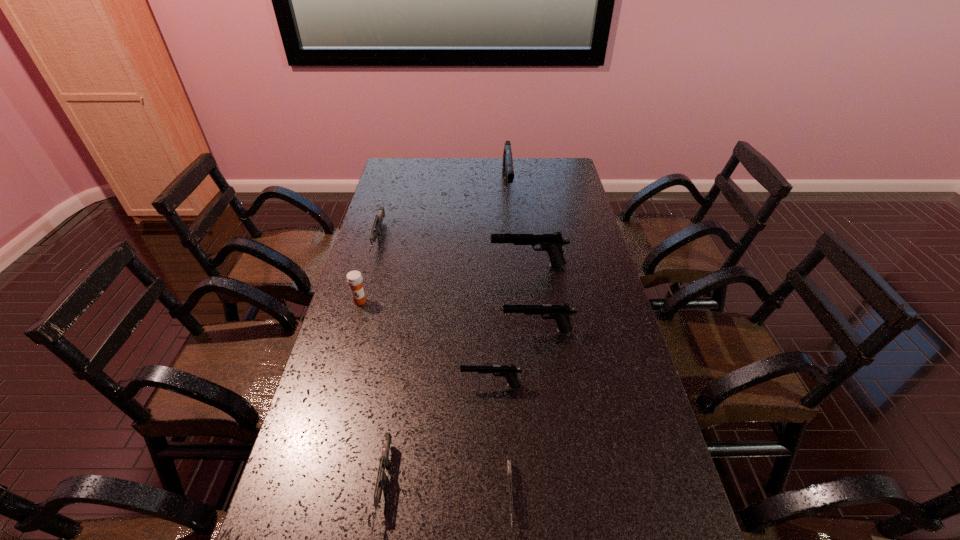
Point out which object is positioned as the nearest to the smallest black gun. Please provide its 2D coordinates. Your answer should be formatted as a tuple, i.e. [(x, y)], where the tuple contains the x and y coordinates of a point satisfying the conditions above.

[(560, 313)]

Locate which gun ranks fourth in proximity to the second farthest black gun. Please provide its 2D coordinates. Your answer should be formatted as a tuple, i.e. [(x, y)], where the tuple contains the x and y coordinates of a point satisfying the conditions above.

[(510, 372)]

Identify the location of the sixth closest gun to the third nearest object. (507, 169).

At what (x,y) coordinates should I click in order to perform the action: click on black gun that is the third closest one to the medicine. Please return your answer as a coordinate pair (x, y). This screenshot has width=960, height=540. Looking at the image, I should click on (560, 313).

Point out which black gun is positioned as the nearest to the second tallest object. Please provide its 2D coordinates. Your answer should be formatted as a tuple, i.e. [(x, y)], where the tuple contains the x and y coordinates of a point satisfying the conditions above.

[(560, 313)]

Point out which grey gun is positioned as the third nearest to the third nearest gun. Please provide its 2D coordinates. Your answer should be formatted as a tuple, i.e. [(x, y)], where the tuple contains the x and y coordinates of a point satisfying the conditions above.

[(377, 225)]

Identify which grey gun is located as the second nearest to the shortest gun. Please provide its 2D coordinates. Your answer should be formatted as a tuple, i.e. [(x, y)], where the tuple contains the x and y coordinates of a point satisfying the conditions above.

[(377, 225)]

The width and height of the screenshot is (960, 540). In order to click on free spot that satisfies the following two spatial constraints: 1. at the aiming end of the second farthest black gun; 2. aimed along the barrel of the rightmost grey gun in this screenshot , I will do `click(558, 497)`.